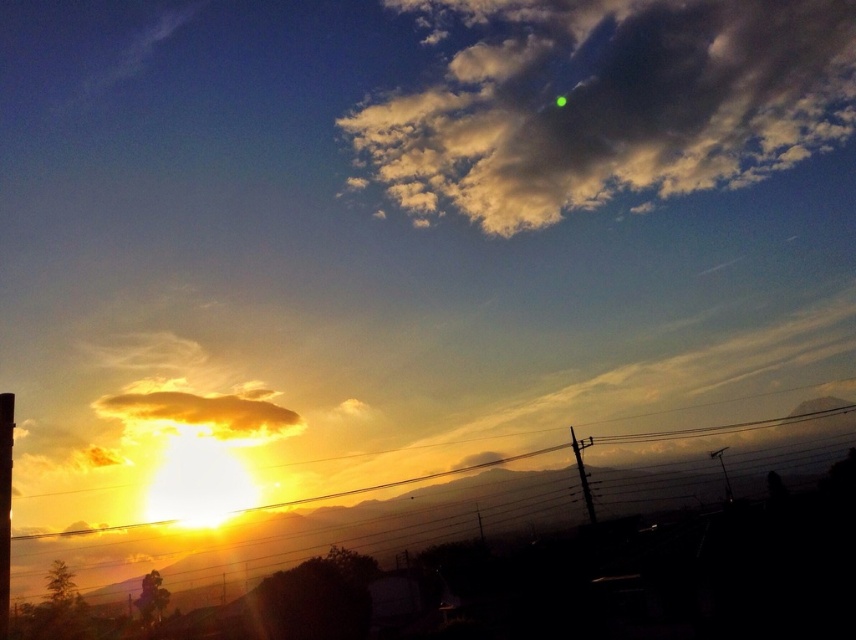
Question: In this image, where is cloudy at upper center located relative to metallic wire at lower left?

Choices:
 (A) right
 (B) left

Answer: (A)

Question: Among these points, which one is nearest to the camera?

Choices:
 (A) (265, 403)
 (B) (599, 518)
 (C) (792, 35)

Answer: (B)

Question: Does cloudy at upper center come behind metallic wire at lower left?

Choices:
 (A) yes
 (B) no

Answer: (A)

Question: Does metallic wire at lower left come behind golden yellow fluffy cloud at lower left?

Choices:
 (A) yes
 (B) no

Answer: (B)

Question: Which point is farther to the camera?

Choices:
 (A) (247, 412)
 (B) (756, 140)
 (C) (723, 433)

Answer: (B)

Question: Estimate the real-world distances between objects in this image. Which object is farther from the metallic wire at lower left?

Choices:
 (A) cloudy at upper center
 (B) golden yellow fluffy cloud at lower left

Answer: (A)